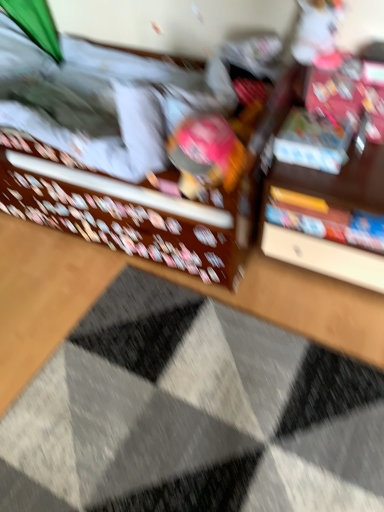
Question: Considering the relative sizes of matte plastic book at upper right, placed as the 2th book when sorted from bottom to top, and hardcover book at center, the second book in the top-to-bottom sequence, in the image provided, is matte plastic book at upper right, placed as the 2th book when sorted from bottom to top, thinner than hardcover book at center, the second book in the top-to-bottom sequence,?

Choices:
 (A) no
 (B) yes

Answer: (A)

Question: Is matte plastic book at upper right, which is the first book from top to bottom, wider than hardcover book at center, the 1th book positioned from the bottom?

Choices:
 (A) yes
 (B) no

Answer: (A)

Question: Is hardcover book at center, the 1th book positioned from the bottom, inside matte plastic book at upper right, which is the first book from top to bottom?

Choices:
 (A) yes
 (B) no

Answer: (B)

Question: From the image's perspective, is matte plastic book at upper right, placed as the 2th book when sorted from bottom to top, beneath hardcover book at center, the second book in the top-to-bottom sequence?

Choices:
 (A) no
 (B) yes

Answer: (A)

Question: Is matte plastic book at upper right, placed as the 2th book when sorted from bottom to top, positioned before hardcover book at center, the 1th book positioned from the bottom?

Choices:
 (A) no
 (B) yes

Answer: (A)

Question: Relative to textured gray doormat at center, is matte plastic book at upper right, placed as the 2th book when sorted from bottom to top, in front or behind?

Choices:
 (A) behind
 (B) front

Answer: (A)

Question: Considering the positions of matte plastic book at upper right, placed as the 2th book when sorted from bottom to top, and textured gray doormat at center in the image, is matte plastic book at upper right, placed as the 2th book when sorted from bottom to top, taller or shorter than textured gray doormat at center?

Choices:
 (A) tall
 (B) short

Answer: (A)

Question: Considering the positions of matte plastic book at upper right, placed as the 2th book when sorted from bottom to top, and textured gray doormat at center in the image, is matte plastic book at upper right, placed as the 2th book when sorted from bottom to top, wider or thinner than textured gray doormat at center?

Choices:
 (A) thin
 (B) wide

Answer: (A)

Question: In terms of size, does matte plastic book at upper right, placed as the 2th book when sorted from bottom to top, appear bigger or smaller than textured gray doormat at center?

Choices:
 (A) small
 (B) big

Answer: (A)

Question: From the image's perspective, is textured gray doormat at center located above or below hardcover book at center, the second book in the top-to-bottom sequence?

Choices:
 (A) below
 (B) above

Answer: (A)

Question: Is textured gray doormat at center bigger or smaller than hardcover book at center, the second book in the top-to-bottom sequence?

Choices:
 (A) small
 (B) big

Answer: (B)

Question: From a real-world perspective, is textured gray doormat at center positioned above or below hardcover book at center, the 1th book positioned from the bottom?

Choices:
 (A) below
 (B) above

Answer: (A)

Question: Considering the positions of textured gray doormat at center and hardcover book at center, the second book in the top-to-bottom sequence, in the image, is textured gray doormat at center taller or shorter than hardcover book at center, the second book in the top-to-bottom sequence,?

Choices:
 (A) short
 (B) tall

Answer: (A)

Question: Considering the positions of point (276, 406) and point (87, 208), is point (276, 406) closer or farther from the camera than point (87, 208)?

Choices:
 (A) farther
 (B) closer

Answer: (B)

Question: From the image's perspective, is textured gray doormat at center positioned above or below matte brown bed at center?

Choices:
 (A) above
 (B) below

Answer: (B)